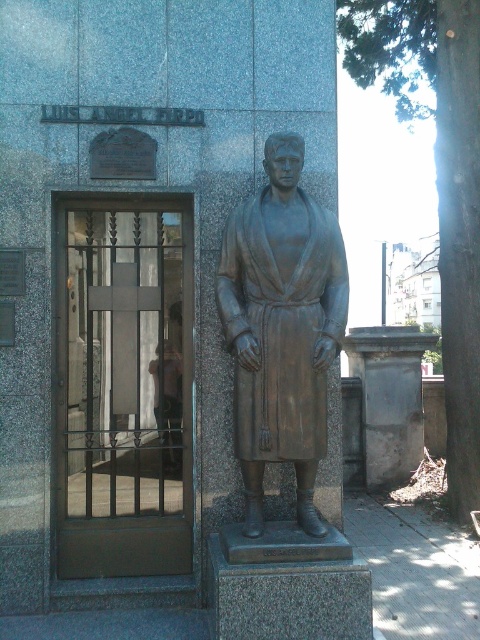
You are standing in front of the bronze statue and want to enter the building through the dark brown metal gate at left. Is the gate to your left or right side?

The dark brown metal gate at left is located to your left side.

You are an art student visiting the statue and notice the dark brown metal gate at left and the bronze statue at center. Which object is larger in size?

The bronze statue at center is larger than the dark brown metal gate at left.